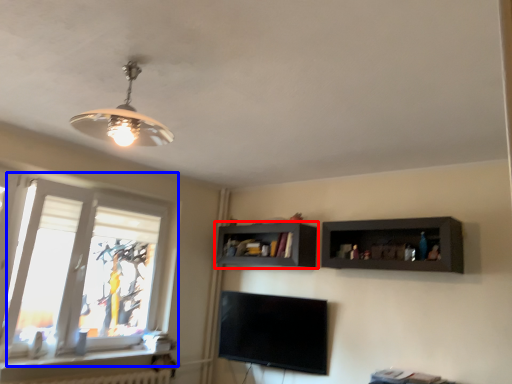
Question: Which of the following is the farthest to the observer, shelf (highlighted by a red box) or window (highlighted by a blue box)?

Choices:
 (A) shelf
 (B) window

Answer: (A)